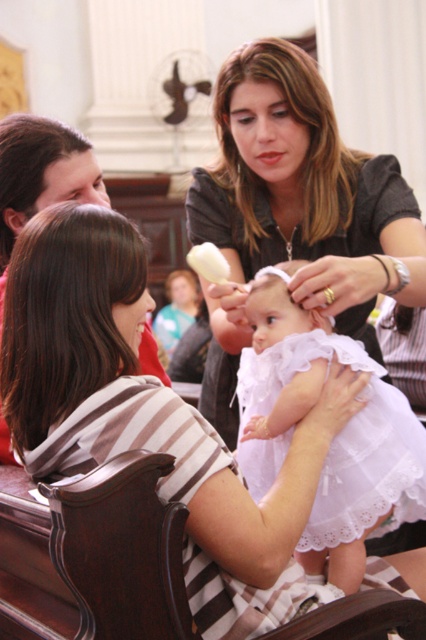
Question: Based on their relative distances, which object is farther from the striped fabric shirt at lower left?

Choices:
 (A) brown striped shirt at lower left
 (B) white lace dress at center
 (C) matte black shirt at upper center

Answer: (A)

Question: Which point is farther to the camera?

Choices:
 (A) matte black shirt at upper center
 (B) brown striped shirt at lower left
 (C) white lace dress at center

Answer: (B)

Question: Is matte black shirt at upper center behind brown striped shirt at lower left?

Choices:
 (A) no
 (B) yes

Answer: (A)

Question: Does striped fabric shirt at lower left have a lesser width compared to brown striped shirt at lower left?

Choices:
 (A) no
 (B) yes

Answer: (B)

Question: Does striped fabric shirt at lower left appear over matte black shirt at upper center?

Choices:
 (A) no
 (B) yes

Answer: (A)

Question: Estimate the real-world distances between objects in this image. Which object is farther from the brown smooth hair at upper center?

Choices:
 (A) striped fabric shirt at lower left
 (B) matte black shirt at upper center
 (C) brown striped shirt at lower left

Answer: (A)